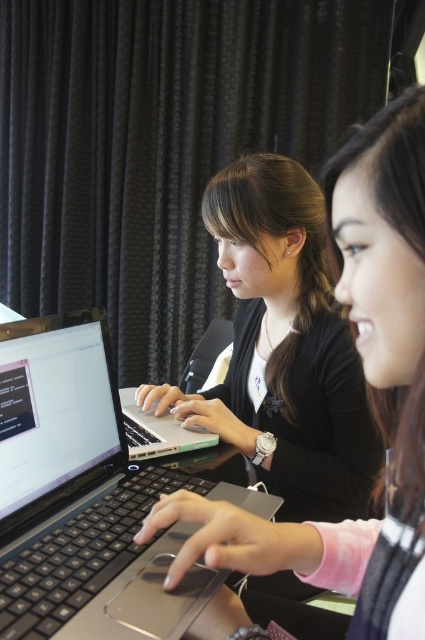
Consider the image. You are organizing a tech fair and need to stack the silver metallic laptop at center and the matte black laptop at left vertically. Which one should you place at the bottom to ensure stability?

You should place the matte black laptop at left at the bottom since it is taller than the silver metallic laptop at center, providing a more stable base.

You are organizing a study group and need to arrange two laptops on a table. The silver metallic laptop at center and the matte black laptop at left must be placed according to their positions in the image. Which laptop should be placed to the right of the other?

The silver metallic laptop at center should be placed to the left of the matte black laptop at left because the description states that the silver metallic laptop at center is positioned on the left side of the matte black laptop at left.

You have a laptop stand that can only hold devices wider than 12 inches. You need to place either the silver metallic laptop at center or the matte black laptop at left on it. Based on their widths, which laptop should you choose?

The silver metallic laptop at center has a greater width than the matte black laptop at left, so you should choose the silver metallic laptop at center for the stand since it is wider.